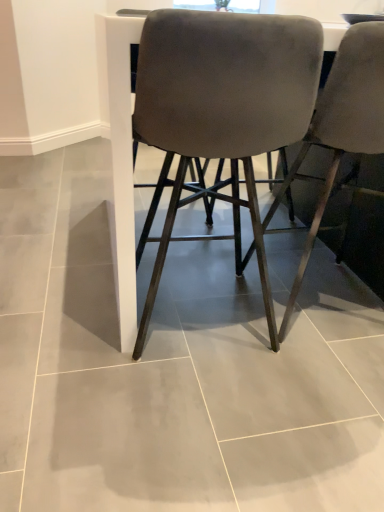
The image size is (384, 512). In order to click on suede-like gray chair at center, which is the second chair in right-to-left order in this screenshot , I will do `click(223, 106)`.

Measure the distance between suede-like gray chair at center, which is the second chair in right-to-left order, and camera.

suede-like gray chair at center, which is the second chair in right-to-left order, is 34.27 inches from camera.

Describe the element at coordinates (223, 106) in the screenshot. I see `suede-like gray chair at center, positioned as the first chair in left-to-right order` at that location.

What is the approximate height of suede-like gray chair at center, positioned as the first chair in left-to-right order?

The height of suede-like gray chair at center, positioned as the first chair in left-to-right order, is 37.21 inches.

What do you see at coordinates (341, 125) in the screenshot?
I see `velvet gray chair at center, which is counted as the 2th chair, starting from the left` at bounding box center [341, 125].

This screenshot has height=512, width=384. Find the location of `velvet gray chair at center, which is counted as the 2th chair, starting from the left`. velvet gray chair at center, which is counted as the 2th chair, starting from the left is located at coordinates (341, 125).

Identify the location of suede-like gray chair at center, which is the second chair in right-to-left order. (223, 106).

Considering the relative positions of suede-like gray chair at center, positioned as the first chair in left-to-right order, and velvet gray chair at center, which ranks as the 1th chair in right-to-left order, in the image provided, is suede-like gray chair at center, positioned as the first chair in left-to-right order, to the left or to the right of velvet gray chair at center, which ranks as the 1th chair in right-to-left order,?

Based on their positions, suede-like gray chair at center, positioned as the first chair in left-to-right order, is located to the left of velvet gray chair at center, which ranks as the 1th chair in right-to-left order.

Does suede-like gray chair at center, positioned as the first chair in left-to-right order, come in front of velvet gray chair at center, which ranks as the 1th chair in right-to-left order?

Yes, suede-like gray chair at center, positioned as the first chair in left-to-right order, is in front of velvet gray chair at center, which ranks as the 1th chair in right-to-left order.

Between point (229, 129) and point (368, 121), which one is positioned behind?

The point (368, 121) is behind.

From the image's perspective, between suede-like gray chair at center, positioned as the first chair in left-to-right order, and velvet gray chair at center, which is counted as the 2th chair, starting from the left, which one is located above?

velvet gray chair at center, which is counted as the 2th chair, starting from the left, from the image's perspective.

From a real-world perspective, who is located lower, suede-like gray chair at center, positioned as the first chair in left-to-right order, or velvet gray chair at center, which is counted as the 2th chair, starting from the left?

From a 3D spatial view, suede-like gray chair at center, positioned as the first chair in left-to-right order, is below.

Between suede-like gray chair at center, which is the second chair in right-to-left order, and velvet gray chair at center, which ranks as the 1th chair in right-to-left order, which one has smaller width?

With smaller width is suede-like gray chair at center, which is the second chair in right-to-left order.

Is suede-like gray chair at center, which is the second chair in right-to-left order, taller than velvet gray chair at center, which is counted as the 2th chair, starting from the left?

No.

Does suede-like gray chair at center, positioned as the first chair in left-to-right order, have a larger size compared to velvet gray chair at center, which ranks as the 1th chair in right-to-left order?

No, suede-like gray chair at center, positioned as the first chair in left-to-right order, is not bigger than velvet gray chair at center, which ranks as the 1th chair in right-to-left order.

Is suede-like gray chair at center, which is the second chair in right-to-left order, completely or partially outside of velvet gray chair at center, which ranks as the 1th chair in right-to-left order?

Yes, suede-like gray chair at center, which is the second chair in right-to-left order, is located beyond the bounds of velvet gray chair at center, which ranks as the 1th chair in right-to-left order.

Is suede-like gray chair at center, which is the second chair in right-to-left order, beside velvet gray chair at center, which ranks as the 1th chair in right-to-left order?

suede-like gray chair at center, which is the second chair in right-to-left order, is not next to velvet gray chair at center, which ranks as the 1th chair in right-to-left order, and they're not touching.

Is suede-like gray chair at center, which is the second chair in right-to-left order, oriented towards velvet gray chair at center, which is counted as the 2th chair, starting from the left?

No, suede-like gray chair at center, which is the second chair in right-to-left order, is not facing towards velvet gray chair at center, which is counted as the 2th chair, starting from the left.

What's the angular difference between suede-like gray chair at center, which is the second chair in right-to-left order, and velvet gray chair at center, which ranks as the 1th chair in right-to-left order,'s facing directions?

The facing directions of suede-like gray chair at center, which is the second chair in right-to-left order, and velvet gray chair at center, which ranks as the 1th chair in right-to-left order, are 0.000569 degrees apart.

Measure the distance from suede-like gray chair at center, positioned as the first chair in left-to-right order, to velvet gray chair at center, which ranks as the 1th chair in right-to-left order.

suede-like gray chair at center, positioned as the first chair in left-to-right order, is 9.04 inches away from velvet gray chair at center, which ranks as the 1th chair in right-to-left order.

In the image, there is a velvet gray chair at center, which ranks as the 1th chair in right-to-left order. Where is `chair below it (from the image's perspective)`? This screenshot has height=512, width=384. chair below it (from the image's perspective) is located at coordinates (223, 106).

Does velvet gray chair at center, which is counted as the 2th chair, starting from the left, appear on the left side of suede-like gray chair at center, positioned as the first chair in left-to-right order?

In fact, velvet gray chair at center, which is counted as the 2th chair, starting from the left, is to the right of suede-like gray chair at center, positioned as the first chair in left-to-right order.

Between velvet gray chair at center, which is counted as the 2th chair, starting from the left, and suede-like gray chair at center, which is the second chair in right-to-left order, which one is positioned behind?

velvet gray chair at center, which is counted as the 2th chair, starting from the left, is behind.

Does point (375, 101) come in front of point (276, 148)?

Yes, it is.

From the image's perspective, is velvet gray chair at center, which is counted as the 2th chair, starting from the left, located beneath suede-like gray chair at center, which is the second chair in right-to-left order?

No, from the image's perspective, velvet gray chair at center, which is counted as the 2th chair, starting from the left, is not beneath suede-like gray chair at center, which is the second chair in right-to-left order.

From a real-world perspective, relative to suede-like gray chair at center, positioned as the first chair in left-to-right order, is velvet gray chair at center, which is counted as the 2th chair, starting from the left, vertically above or below?

velvet gray chair at center, which is counted as the 2th chair, starting from the left, is situated higher than suede-like gray chair at center, positioned as the first chair in left-to-right order, in the real world.

Between velvet gray chair at center, which is counted as the 2th chair, starting from the left, and suede-like gray chair at center, which is the second chair in right-to-left order, which one has smaller width?

suede-like gray chair at center, which is the second chair in right-to-left order.

Considering the sizes of velvet gray chair at center, which ranks as the 1th chair in right-to-left order, and suede-like gray chair at center, which is the second chair in right-to-left order, in the image, is velvet gray chair at center, which ranks as the 1th chair in right-to-left order, taller or shorter than suede-like gray chair at center, which is the second chair in right-to-left order,?

Considering their sizes, velvet gray chair at center, which ranks as the 1th chair in right-to-left order, has more height than suede-like gray chair at center, which is the second chair in right-to-left order.

Does velvet gray chair at center, which is counted as the 2th chair, starting from the left, have a larger size compared to suede-like gray chair at center, positioned as the first chair in left-to-right order?

Correct, velvet gray chair at center, which is counted as the 2th chair, starting from the left, is larger in size than suede-like gray chair at center, positioned as the first chair in left-to-right order.

Is suede-like gray chair at center, positioned as the first chair in left-to-right order, a part of velvet gray chair at center, which ranks as the 1th chair in right-to-left order?

No.

Are velvet gray chair at center, which is counted as the 2th chair, starting from the left, and suede-like gray chair at center, positioned as the first chair in left-to-right order, located far from each other?

No, velvet gray chair at center, which is counted as the 2th chair, starting from the left, is in close proximity to suede-like gray chair at center, positioned as the first chair in left-to-right order.

Is velvet gray chair at center, which ranks as the 1th chair in right-to-left order, oriented towards suede-like gray chair at center, positioned as the first chair in left-to-right order?

No, velvet gray chair at center, which ranks as the 1th chair in right-to-left order, is not aimed at suede-like gray chair at center, positioned as the first chair in left-to-right order.

This screenshot has height=512, width=384. I want to click on chair lying on the right of suede-like gray chair at center, which is the second chair in right-to-left order, so coord(341,125).

There is a suede-like gray chair at center, which is the second chair in right-to-left order. In order to click on chair above it (from a real-world perspective) in this screenshot , I will do `click(341, 125)`.

Where is `chair that appears on the right of suede-like gray chair at center, which is the second chair in right-to-left order`? This screenshot has width=384, height=512. chair that appears on the right of suede-like gray chair at center, which is the second chair in right-to-left order is located at coordinates (341, 125).